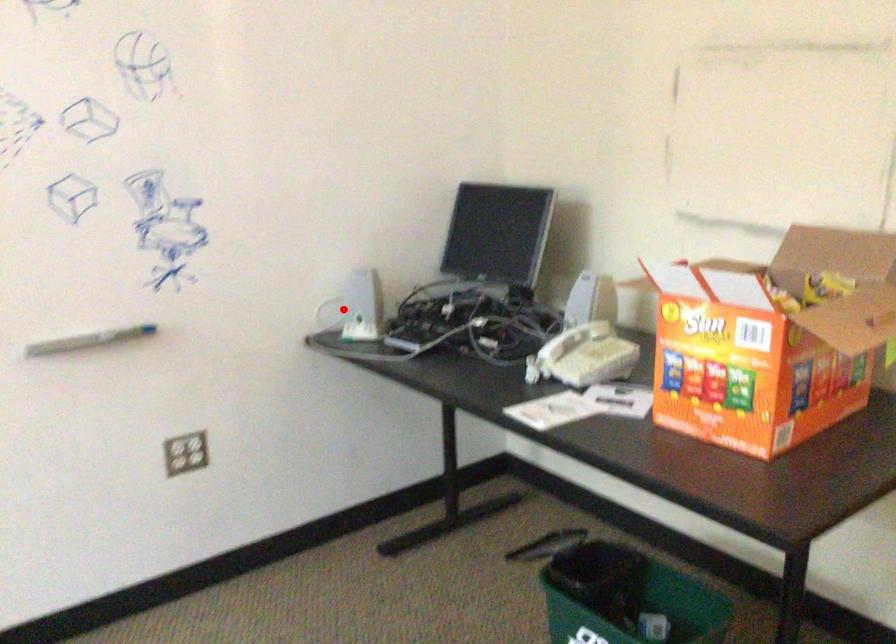
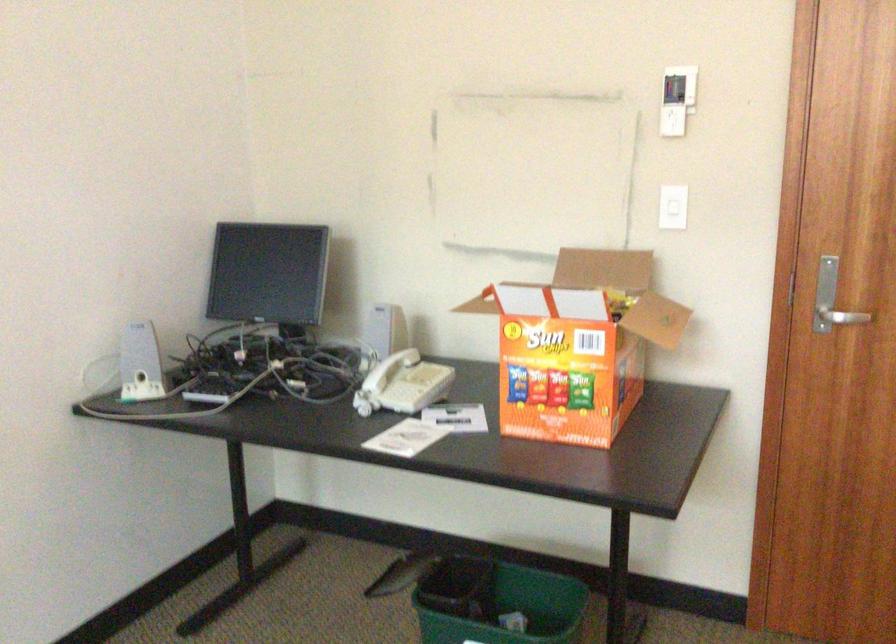
Question: I am providing you with two images of the same scene from different viewpoints. In image1, a red point is highlighted. Considering the same 3D point in image2, which of the following is correct?

Choices:
 (A) It is closer
 (B) It is farther

Answer: (A)